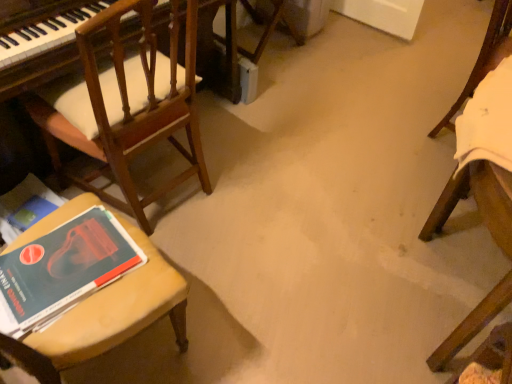
What are the coordinates of `empty space that is to the right of wooden chair at left, acting as the first chair starting from the left` in the screenshot? It's located at (256, 193).